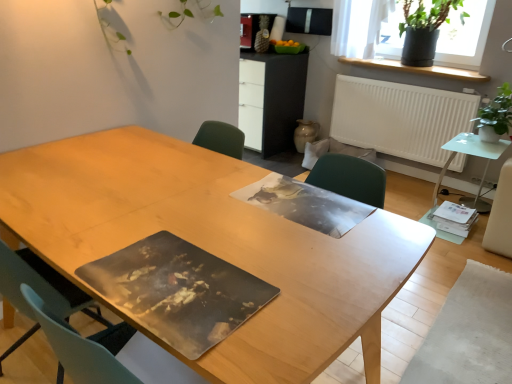
Question: Considering the positions of translucent glass side table at right, the 2th table viewed from the left, and matte black cabinet at center in the image, is translucent glass side table at right, the 2th table viewed from the left, bigger or smaller than matte black cabinet at center?

Choices:
 (A) big
 (B) small

Answer: (B)

Question: Considering the positions of translucent glass side table at right, which is counted as the 2th table, starting from the front, and matte black cabinet at center in the image, is translucent glass side table at right, which is counted as the 2th table, starting from the front, taller or shorter than matte black cabinet at center?

Choices:
 (A) tall
 (B) short

Answer: (B)

Question: Which object is the farthest from the green matte plant pot at upper right, acting as the 1th houseplant starting from the top?

Choices:
 (A) white matte radiator at upper right
 (B) green matte plant pot at upper right
 (C) green leafy plant at right, the 2th houseplant from the back
 (D) matte black cabinet at center
 (E) translucent glass side table at right, the 2th table viewed from the left

Answer: (E)

Question: Based on their relative distances, which object is farther from the matte black cabinet at center?

Choices:
 (A) wooden table at center, marked as the first table in a front-to-back arrangement
 (B) green matte plant pot at upper right, the second houseplant positioned from the front
 (C) green leafy plant at right, the 2th houseplant from the back
 (D) translucent glass side table at right, which ranks as the first table in back-to-front order
 (E) green matte plant pot at upper right

Answer: (A)